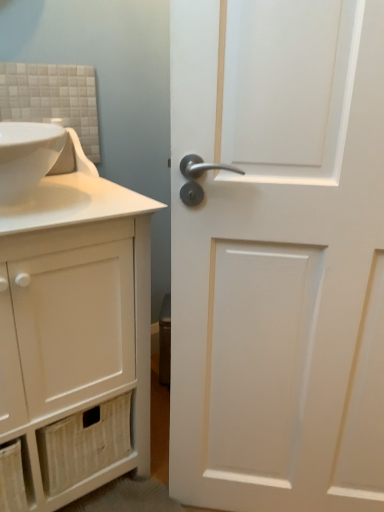
Describe the element at coordinates (278, 255) in the screenshot. I see `white matte door at right` at that location.

Measure the distance between white glossy sink at upper left and camera.

They are 77.50 centimeters apart.

Image resolution: width=384 pixels, height=512 pixels. I want to click on white matte cabinet at left, so click(73, 339).

Image resolution: width=384 pixels, height=512 pixels. Identify the location of white matte door at right. (278, 255).

From the image's perspective, is white glossy sink at upper left below white matte cabinet at left?

Actually, white glossy sink at upper left appears above white matte cabinet at left in the image.

Is point (48, 146) farther from camera compared to point (29, 337)?

No, it is not.

Between white glossy sink at upper left and white matte cabinet at left, which one has smaller width?

With smaller width is white glossy sink at upper left.

Considering the relative sizes of white matte cabinet at left and white matte door at right in the image provided, is white matte cabinet at left shorter than white matte door at right?

Correct, white matte cabinet at left is not as tall as white matte door at right.

Which is nearer, (140, 226) or (288, 270)?

Point (140, 226) is positioned farther from the camera compared to point (288, 270).

Is white matte cabinet at left inside the boundaries of white matte door at right, or outside?

white matte cabinet at left is outside white matte door at right.

Considering the relative sizes of white matte cabinet at left and white matte door at right in the image provided, is white matte cabinet at left thinner than white matte door at right?

Incorrect, the width of white matte cabinet at left is not less than that of white matte door at right.

Which object is further away from the camera taking this photo, white matte door at right or white matte cabinet at left?

white matte cabinet at left is further from the camera.

From the image's perspective, is white matte door at right located beneath white matte cabinet at left?

No.

How far apart are white matte door at right and white matte cabinet at left?

11.07 inches.

Is white matte door at right in contact with white matte cabinet at left?

No.

Image resolution: width=384 pixels, height=512 pixels. Identify the location of sink on the left of the white matte door at right. (27, 156).

Which object is further away from the camera, white glossy sink at upper left or white matte door at right?

Positioned behind is white glossy sink at upper left.

Which point is more forward, (20, 176) or (347, 213)?

The point (20, 176) is more forward.

From a real-world perspective, which is physically above, white glossy sink at upper left or white matte door at right?

white glossy sink at upper left is physically above.

Is white matte door at right facing towards white glossy sink at upper left?

No, white matte door at right is not aimed at white glossy sink at upper left.

What's the angular difference between white matte door at right and white glossy sink at upper left's facing directions?

The angle between the facing direction of white matte door at right and the facing direction of white glossy sink at upper left is 42.8 degrees.

Based on their sizes in the image, would you say white matte door at right is bigger or smaller than white glossy sink at upper left?

Considering their sizes, white matte door at right takes up more space than white glossy sink at upper left.

Find the location of a particular element. sink that is behind the white matte door at right is located at coordinates (27, 156).

From the picture: Which object is wider, white matte cabinet at left or white glossy sink at upper left?

Wider between the two is white matte cabinet at left.

Considering the positions of objects white matte cabinet at left and white glossy sink at upper left in the image provided, who is more to the right, white matte cabinet at left or white glossy sink at upper left?

white matte cabinet at left is more to the right.

Identify the location of bathroom cabinet below the white glossy sink at upper left (from the image's perspective). Image resolution: width=384 pixels, height=512 pixels. (73, 339).

Looking at this image, could you tell me if white matte cabinet at left is facing white glossy sink at upper left?

No, white matte cabinet at left is not aimed at white glossy sink at upper left.

Where is `bathroom cabinet below the white glossy sink at upper left (from a real-world perspective)`? bathroom cabinet below the white glossy sink at upper left (from a real-world perspective) is located at coordinates (73, 339).

Locate an element on the screen. This screenshot has height=512, width=384. bathroom cabinet that appears on the left of white matte door at right is located at coordinates (73, 339).

Considering their positions, is white glossy sink at upper left positioned closer to white matte door at right than white matte cabinet at left?

Among the two, white matte cabinet at left is located nearer to white matte door at right.

Based on their spatial positions, is white matte cabinet at left or white matte door at right further from white glossy sink at upper left?

Among the two, white matte door at right is located further to white glossy sink at upper left.

Which object lies nearer to the anchor point white matte cabinet at left, white glossy sink at upper left or white matte door at right?

white matte door at right is positioned closer to the anchor white matte cabinet at left.

Based on their spatial positions, is white matte cabinet at left or white glossy sink at upper left further from white matte door at right?

Based on the image, white glossy sink at upper left appears to be further to white matte door at right.

Considering their positions, is white matte door at right positioned closer to white glossy sink at upper left than white matte cabinet at left?

Among the two, white matte cabinet at left is located nearer to white glossy sink at upper left.

Based on their spatial positions, is white matte door at right or white glossy sink at upper left closer to white matte cabinet at left?

white matte door at right is positioned closer to the anchor white matte cabinet at left.

At what (x,y) coordinates should I click in order to perform the action: click on bathroom cabinet between white glossy sink at upper left and white matte door at right from left to right. Please return your answer as a coordinate pair (x, y). Looking at the image, I should click on (73, 339).